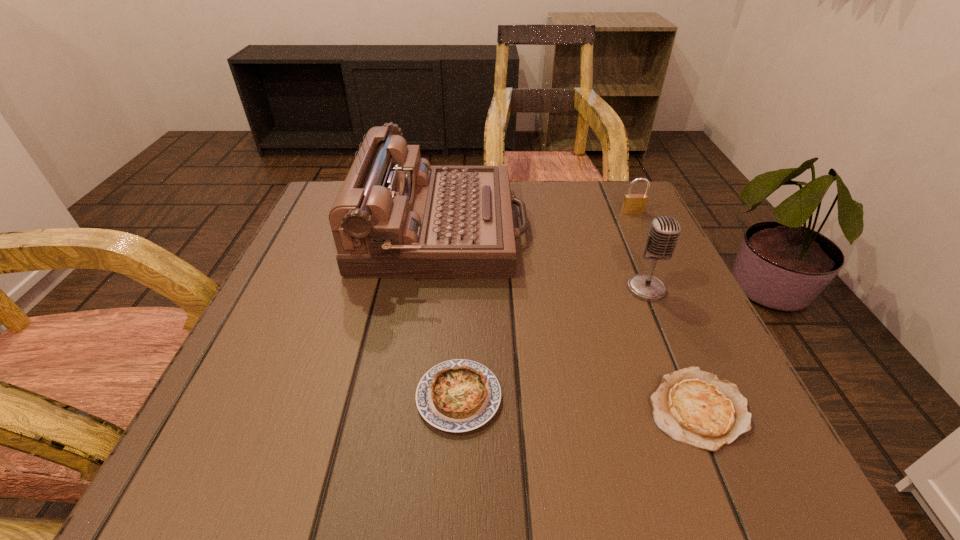
Identify the location of the tallest object. (395, 216).

Locate an element on the screen. The height and width of the screenshot is (540, 960). microphone is located at coordinates (664, 232).

The image size is (960, 540). Identify the location of the third tallest object. (633, 203).

Find the location of a particular element. the fourth tallest object is located at coordinates (459, 395).

Where is `the left quiche`? the left quiche is located at coordinates (459, 395).

I want to click on the right quiche, so click(x=692, y=406).

Image resolution: width=960 pixels, height=540 pixels. In order to click on the shorter quiche in this screenshot , I will do `click(692, 406)`.

What are the coordinates of `vacant space located 0.100m on the keyboard of the tallest object` in the screenshot? It's located at (571, 228).

What are the coordinates of `free space located on the back of the microphone` in the screenshot? It's located at (606, 194).

The height and width of the screenshot is (540, 960). I want to click on vacant space located 0.140m on the front-facing side of the third tallest object, so click(x=652, y=252).